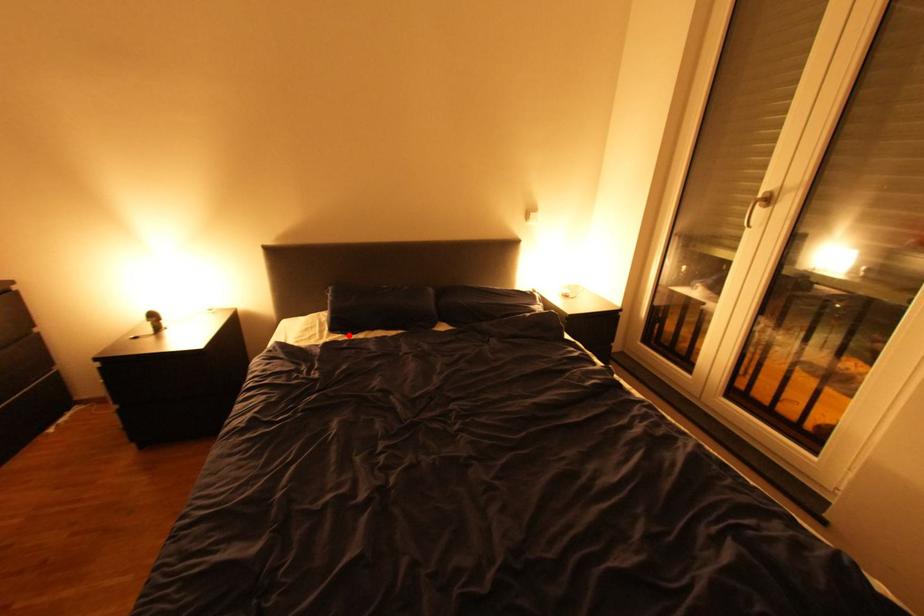
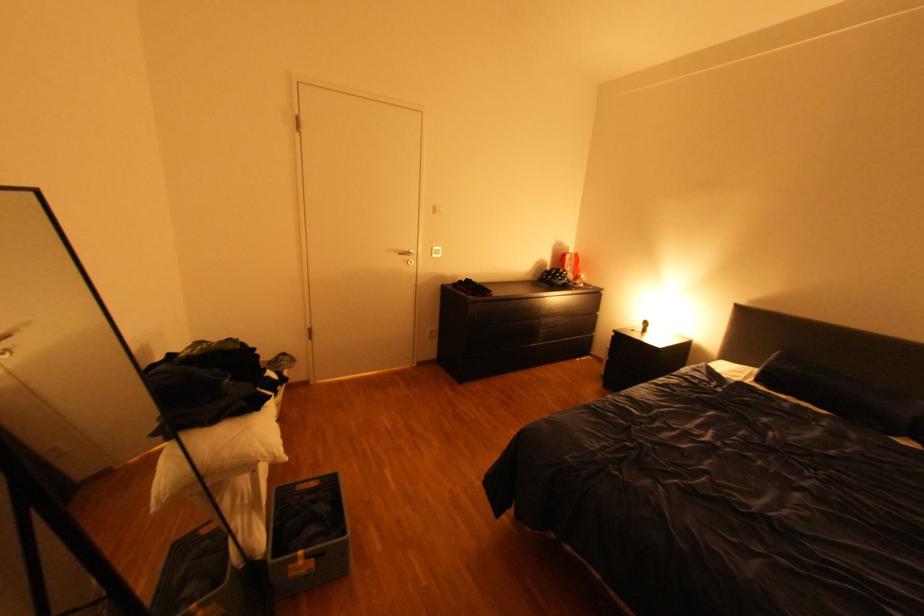
In the second image, find the point that corresponds to the highlighted location in the first image.

(771, 387)